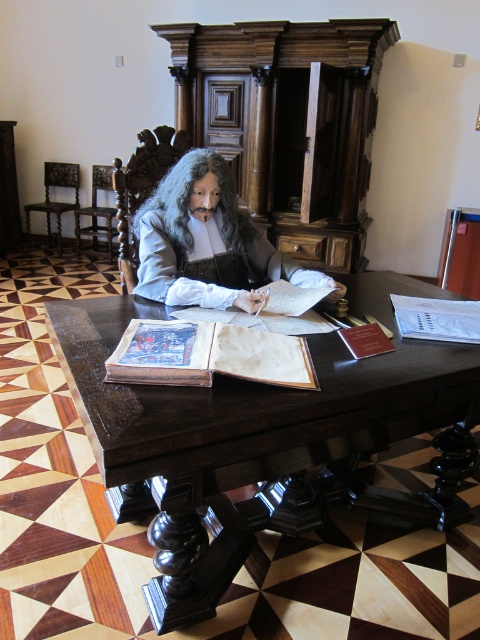
Question: Is smooth gray wig at center positioned before grayhair at center?

Choices:
 (A) no
 (B) yes

Answer: (B)

Question: Which object is closer to the camera taking this photo?

Choices:
 (A) wooden chair at center
 (B) grayhair at center
 (C) dark wood table at center
 (D) matte leather book at center

Answer: (C)

Question: Among these objects, which one is farthest from the camera?

Choices:
 (A) dark wood table at center
 (B) matte leather book at center
 (C) dark wood chair at left
 (D) white paper book at center

Answer: (C)

Question: Can you confirm if dark wood chair at left is smaller than wooden chair at center?

Choices:
 (A) no
 (B) yes

Answer: (B)

Question: Which object is positioned closest to the dark wood table at center?

Choices:
 (A) white paper book at center
 (B) smooth gray wig at center
 (C) matte leather book at center

Answer: (C)

Question: Can you confirm if dark wood table at center is positioned below dark wood chair at left?

Choices:
 (A) no
 (B) yes

Answer: (B)